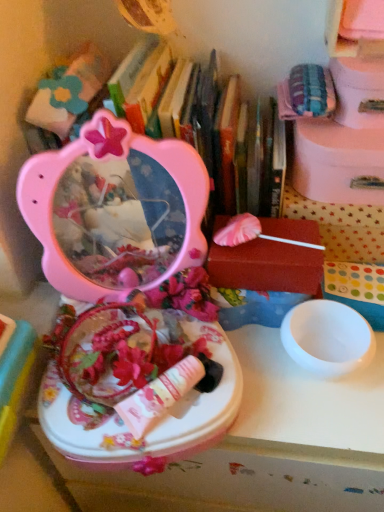
Question: Considering the relative positions of white glossy table at center and white polka dot fabric at upper right, arranged as the third storage box when viewed from the top, in the image provided, is white glossy table at center in front of white polka dot fabric at upper right, arranged as the third storage box when viewed from the top,?

Choices:
 (A) yes
 (B) no

Answer: (A)

Question: Is white glossy table at center further to camera compared to white polka dot fabric at upper right, arranged as the third storage box when viewed from the top?

Choices:
 (A) no
 (B) yes

Answer: (A)

Question: Is white glossy table at center to the left of white polka dot fabric at upper right, the second storage box when ordered from bottom to top, from the viewer's perspective?

Choices:
 (A) no
 (B) yes

Answer: (B)

Question: From a real-world perspective, is white glossy table at center on white polka dot fabric at upper right, arranged as the third storage box when viewed from the top?

Choices:
 (A) no
 (B) yes

Answer: (A)

Question: Is white glossy table at center with white polka dot fabric at upper right, arranged as the third storage box when viewed from the top?

Choices:
 (A) no
 (B) yes

Answer: (A)

Question: Is white glossy table at center taller than white polka dot fabric at upper right, the second storage box when ordered from bottom to top?

Choices:
 (A) yes
 (B) no

Answer: (A)

Question: Can you confirm if pink plastic storage box at upper right, marked as the first storage box in a top-to-bottom arrangement, is bigger than pink plastic mirror at upper left?

Choices:
 (A) yes
 (B) no

Answer: (B)

Question: From a real-world perspective, is pink plastic storage box at upper right, marked as the fourth storage box in a bottom-to-top arrangement, on top of pink plastic mirror at upper left?

Choices:
 (A) no
 (B) yes

Answer: (B)

Question: From the image's perspective, is pink plastic storage box at upper right, marked as the fourth storage box in a bottom-to-top arrangement, located beneath pink plastic mirror at upper left?

Choices:
 (A) no
 (B) yes

Answer: (A)

Question: Is pink plastic storage box at upper right, marked as the fourth storage box in a bottom-to-top arrangement, facing towards pink plastic mirror at upper left?

Choices:
 (A) no
 (B) yes

Answer: (A)

Question: Is pink plastic storage box at upper right, marked as the first storage box in a top-to-bottom arrangement, shorter than pink plastic mirror at upper left?

Choices:
 (A) yes
 (B) no

Answer: (A)

Question: From the image's perspective, is pink plastic storage box at upper right, marked as the first storage box in a top-to-bottom arrangement, located above pink plastic mirror at upper left?

Choices:
 (A) no
 (B) yes

Answer: (B)

Question: From the image's perspective, is pink cardboard box at upper right, acting as the 3th storage box starting from the bottom, above white polka dot fabric at upper right, arranged as the third storage box when viewed from the top?

Choices:
 (A) yes
 (B) no

Answer: (A)